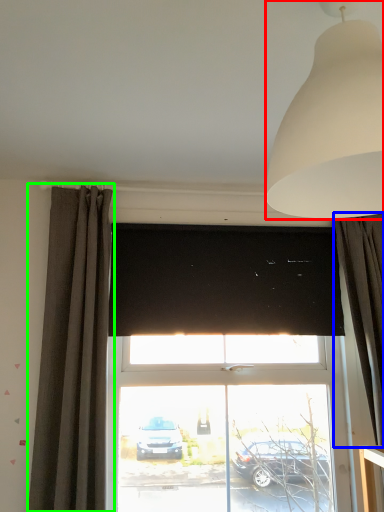
Question: Estimate the real-world distances between objects in this image. Which object is closer to lamp (highlighted by a red box), curtain (highlighted by a blue box) or curtain (highlighted by a green box)?

Choices:
 (A) curtain
 (B) curtain

Answer: (A)